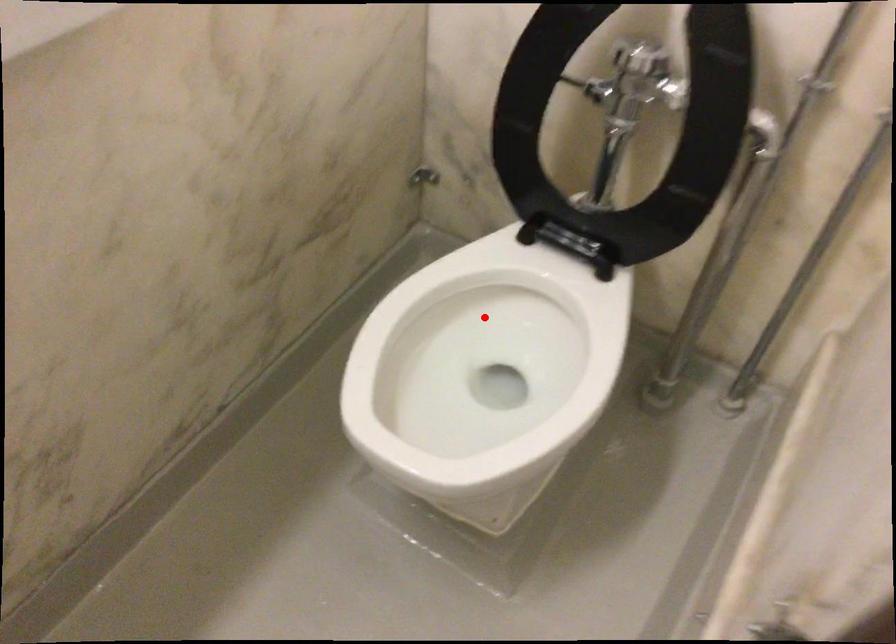
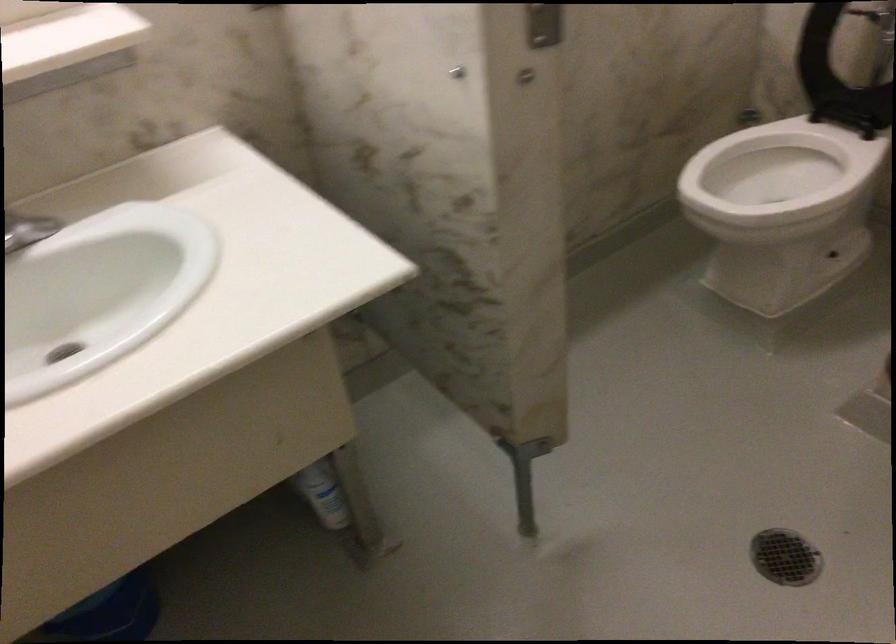
The point at the highlighted location is marked in the first image. Where is the corresponding point in the second image?

(778, 173)